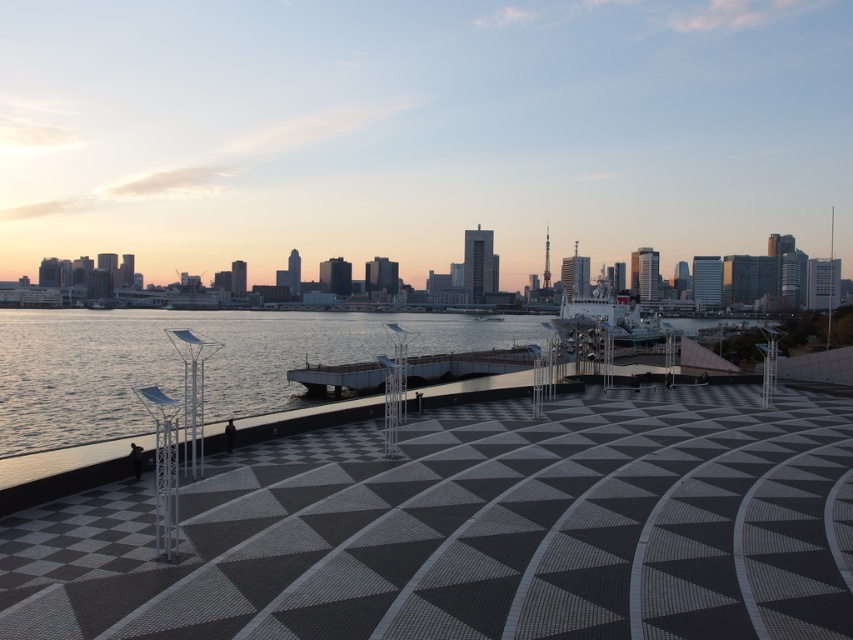
You are standing at the edge of the plaza and notice the clear water at lower left and the shiny metallic ship at center. Which object is closer to the water surface?

The clear water at lower left is positioned under the shiny metallic ship at center, so the clear water at lower left is closer to the water surface.

You are standing at the edge of the plaza facing the waterfront. You see the clear water at lower left and the shiny metallic ship at center. Which object is closer to your right side?

The shiny metallic ship at center is closer to your right side because it is to the right of the clear water at lower left.

You are a photographer planning to capture the entire scene in one shot. You notice the clear water at lower left and the shiny metallic ship at center. Which object is wider in the image?

The clear water at lower left is wider than the shiny metallic ship at center.